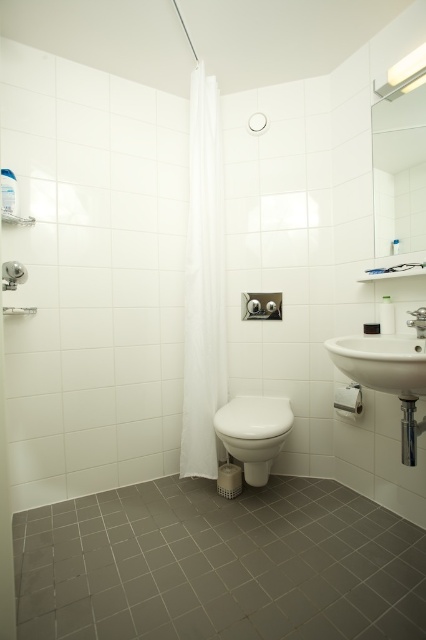
Does point (394, 348) lie behind point (264, 465)?

No.

Can you confirm if white ceramic sink at right is positioned below white glossy toilet bowl at center?

Incorrect, white ceramic sink at right is not positioned below white glossy toilet bowl at center.

Is point (374, 340) closer to viewer compared to point (258, 467)?

Yes, point (374, 340) is closer to viewer.

Locate an element on the screen. This screenshot has height=640, width=426. white ceramic sink at right is located at coordinates [x=385, y=358].

Between white ceramic sink at right and brushed metal shower at left, which one has less height?

Standing shorter between the two is brushed metal shower at left.

Between point (371, 337) and point (5, 262), which one is positioned behind?

The point (371, 337) is more distant.

Find the location of `white ceramic sink at right`. white ceramic sink at right is located at coordinates (385, 358).

Can you confirm if white sheer curtain at center is positioned to the right of brushed metal shower at left?

Yes, white sheer curtain at center is to the right of brushed metal shower at left.

Between point (209, 172) and point (14, 273), which one is positioned in front?

Point (14, 273) is more forward.

Is point (195, 97) positioned behind point (14, 276)?

Yes, point (195, 97) is farther from viewer.

What are the coordinates of `white sheer curtain at center` in the screenshot? It's located at (204, 285).